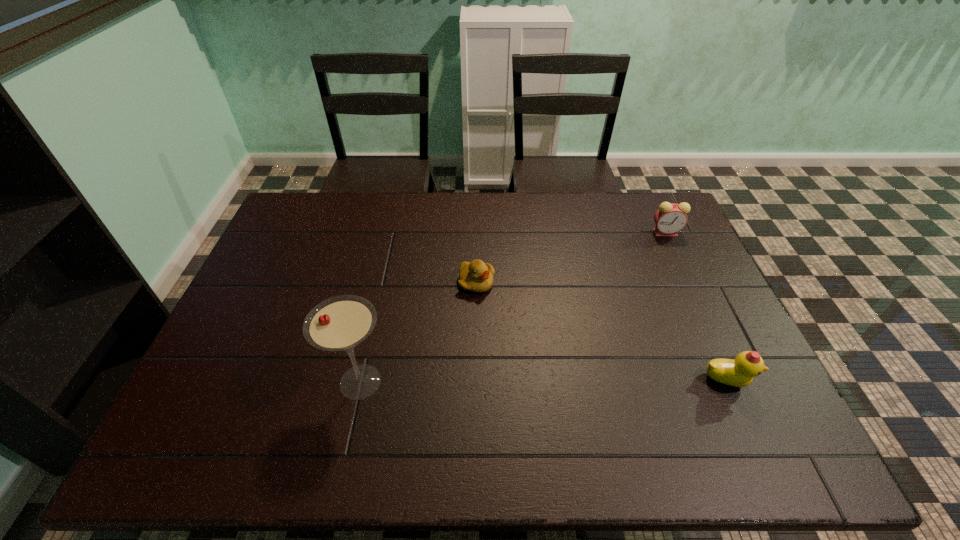
Find the location of a particular element. This screenshot has width=960, height=540. free spot between the martini and the nearer duckling is located at coordinates (544, 381).

What are the coordinates of `blank region between the taller duckling and the shortest object` in the screenshot? It's located at (602, 332).

Locate an element on the screen. Image resolution: width=960 pixels, height=540 pixels. vacant point located between the alarm clock and the martini is located at coordinates (513, 307).

The width and height of the screenshot is (960, 540). I want to click on free space that is in between the leftmost object and the shortest object, so coord(419,332).

Locate an element on the screen. The width and height of the screenshot is (960, 540). free space that is in between the taller duckling and the farthest object is located at coordinates (x=696, y=306).

Locate an element on the screen. vacant space that is in between the alarm clock and the farther duckling is located at coordinates (571, 257).

Identify which object is the closest to the martini. Please provide its 2D coordinates. Your answer should be formatted as a tuple, i.e. [(x, y)], where the tuple contains the x and y coordinates of a point satisfying the conditions above.

[(476, 276)]

Locate an element on the screen. This screenshot has height=540, width=960. object that is the closest to the taller duckling is located at coordinates (670, 218).

Locate an element on the screen. Image resolution: width=960 pixels, height=540 pixels. free location that satisfies the following two spatial constraints: 1. on the back side of the martini; 2. on the right side of the farther duckling is located at coordinates (382, 283).

Identify the location of vacant point that satisfies the following two spatial constraints: 1. on the front side of the shorter duckling; 2. on the front-facing side of the taller duckling. (476, 381).